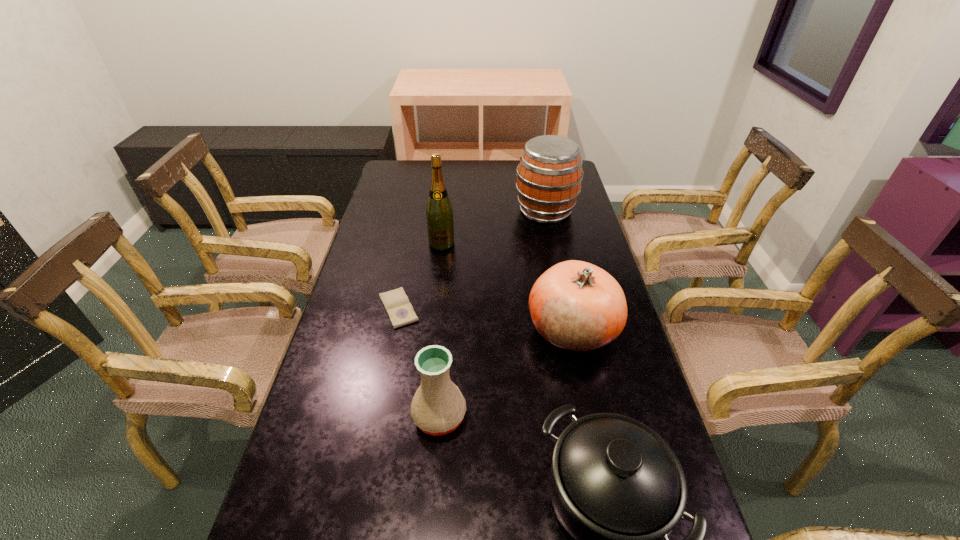
You are a GUI agent. You are given a task and a screenshot of the screen. Output one action in this format:
    pyautogui.click(x=<x>, y=<y>)
    Task: Click on the free space that satisfies the following two spatial constraints: 1. on the front-facing side of the pottery; 2. on the left side of the second farthest object
    This screenshot has width=960, height=540.
    Given the screenshot: What is the action you would take?
    pyautogui.click(x=422, y=416)

Image resolution: width=960 pixels, height=540 pixels. I want to click on free space that satisfies the following two spatial constraints: 1. on the front-facing side of the wine bottle; 2. on the right side of the pottery, so click(422, 416).

Image resolution: width=960 pixels, height=540 pixels. Identify the location of free location that satisfies the following two spatial constraints: 1. on the front-facing side of the pumpkin; 2. on the left side of the second farthest object. (432, 329).

Locate an element on the screen. The height and width of the screenshot is (540, 960). vacant area that satisfies the following two spatial constraints: 1. on the front side of the pottery; 2. on the right side of the diary is located at coordinates (377, 416).